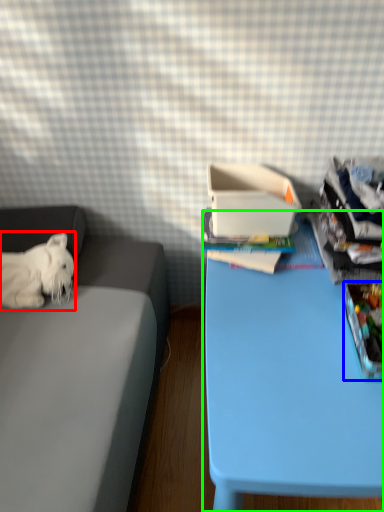
Question: Estimate the real-world distances between objects in this image. Which object is farther from dog (highlighted by a red box), storage box (highlighted by a blue box) or table (highlighted by a green box)?

Choices:
 (A) storage box
 (B) table

Answer: (A)